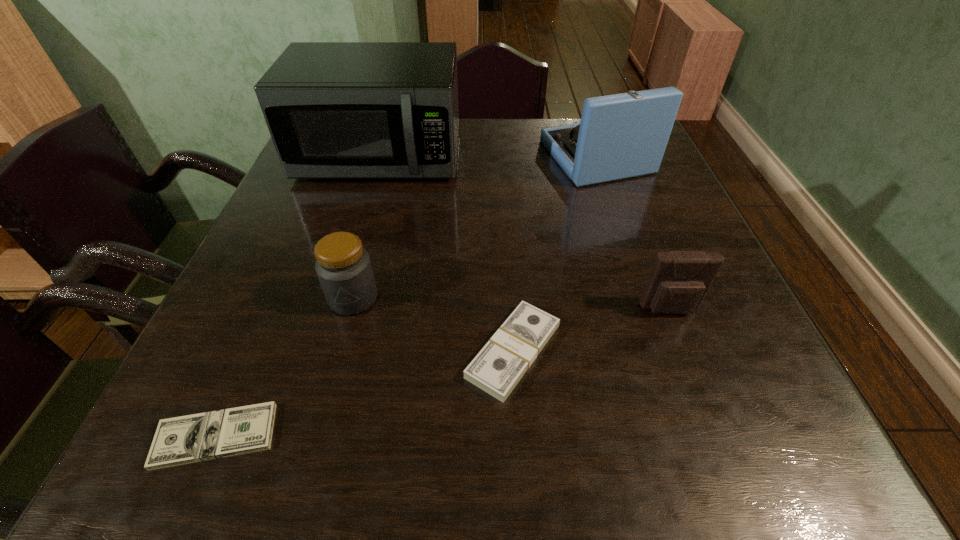
At what (x,y) coordinates should I click in order to perform the action: click on microwave oven. Please return your answer as a coordinate pair (x, y). This screenshot has width=960, height=540. Looking at the image, I should click on (335, 110).

Locate an element on the screen. This screenshot has height=540, width=960. phonograph record is located at coordinates (620, 136).

Locate an element on the screen. Image resolution: width=960 pixels, height=540 pixels. jar is located at coordinates (343, 266).

The height and width of the screenshot is (540, 960). Find the location of `pouch`. pouch is located at coordinates (679, 281).

This screenshot has height=540, width=960. What are the coordinates of `the fourth object from left to right` in the screenshot? It's located at (498, 367).

Where is `the taller dollar`? the taller dollar is located at coordinates click(x=498, y=367).

Find the location of a particular element. the nearer dollar is located at coordinates (193, 438).

The image size is (960, 540). I want to click on the shortest object, so click(193, 438).

Where is `free space located on the front-facing side of the microwave oven`? This screenshot has width=960, height=540. free space located on the front-facing side of the microwave oven is located at coordinates (x=356, y=238).

The width and height of the screenshot is (960, 540). Find the location of `blank area located 0.350m on the left of the phonograph record`. blank area located 0.350m on the left of the phonograph record is located at coordinates (413, 157).